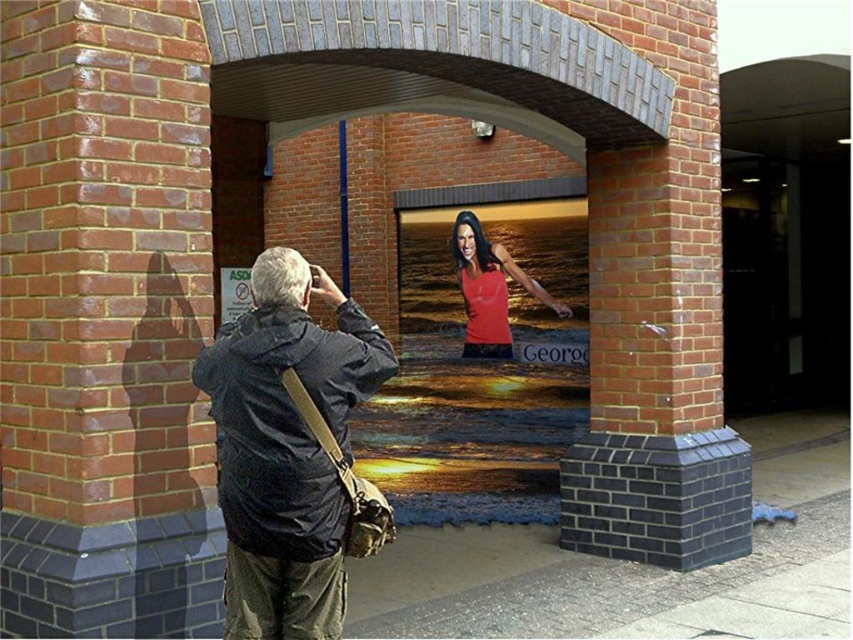
You are a fashion designer observing the image. You need to decide which clothing item, the dark blue jacket at center or the matte red tank top at center, can be displayed in a narrow showcase that is only 1 meter wide. Which one would you choose?

The dark blue jacket at center has a smaller width than the matte red tank top at center, so it can fit into the narrow showcase that is 1 meter wide.

You are standing in the scene and want to take a photo of the point at coordinates point (238, 634) and point (474, 316). Which point should be closer to the camera lens to ensure both are in focus?

Point (238, 634) is in front of point (474, 316), so to ensure both are in focus, the camera should be focused on the closer point, which is point (238, 634).

You are standing in the scene depicted in the image. There is a dark blue jacket at center located at point (286, 448). If you want to pick up the dark blue jacket at center, which direction should you move relative to the man taking the photograph?

The dark blue jacket at center is located at point (286, 448), so you should move towards the center of the image, which is directly in front of the man taking the photograph.